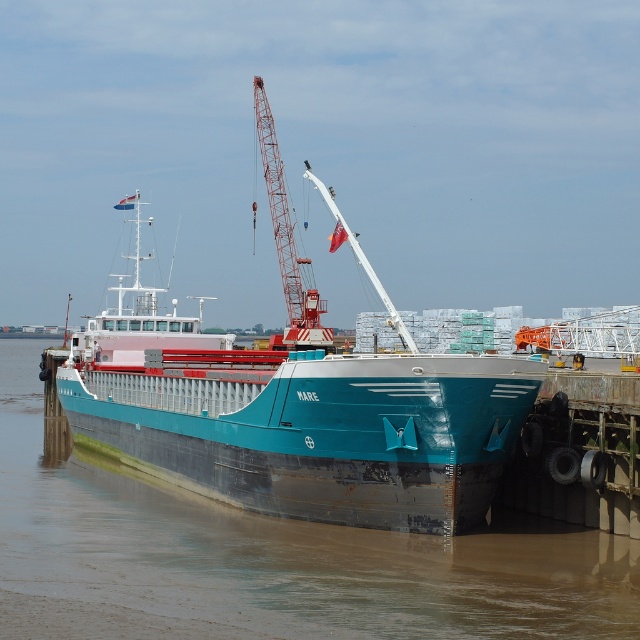
Question: Is teal metallic water at lower left positioned at the back of teal matte barge at center?

Choices:
 (A) no
 (B) yes

Answer: (A)

Question: Is teal matte barge at center in front of red metallic crane at center?

Choices:
 (A) no
 (B) yes

Answer: (B)

Question: Is teal metallic water at lower left below red metallic crane at center?

Choices:
 (A) yes
 (B) no

Answer: (A)

Question: Among these objects, which one is nearest to the camera?

Choices:
 (A) teal metallic water at lower left
 (B) red metallic crane at center

Answer: (A)

Question: Which point is closer to the camera?

Choices:
 (A) teal metallic water at lower left
 (B) red metallic crane at center

Answer: (A)

Question: Which object appears closest to the camera in this image?

Choices:
 (A) red metallic crane at center
 (B) teal metallic water at lower left

Answer: (B)